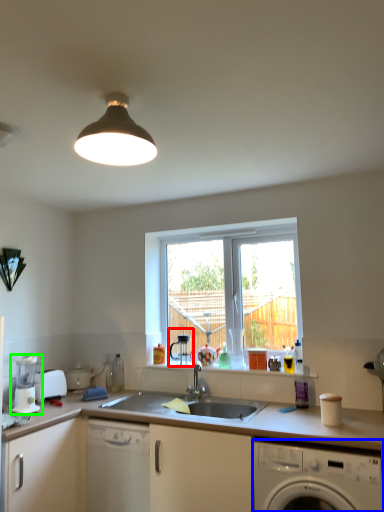
Question: Which is nearer to the coffee machine (highlighted by a red box)? washing machine (highlighted by a blue box) or coffee machine (highlighted by a green box).

Choices:
 (A) washing machine
 (B) coffee machine

Answer: (B)